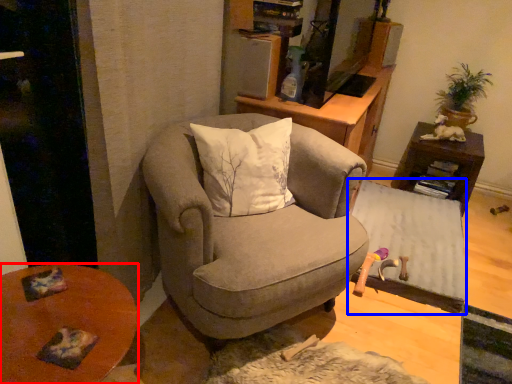
Question: Which of the following is the farthest to the observer, desk (highlighted by a red box) or table (highlighted by a blue box)?

Choices:
 (A) desk
 (B) table

Answer: (B)